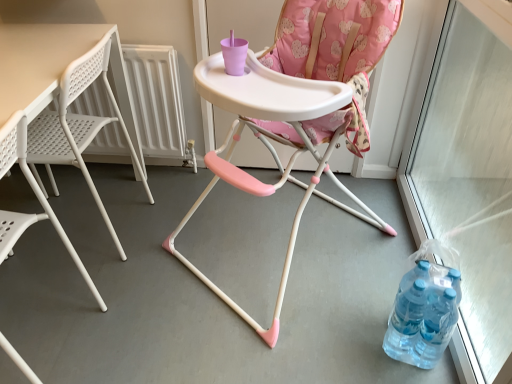
At what (x,y) coordinates should I click in order to perform the action: click on vacant area located to the right-hand side of white plastic table at left. Please return your answer as a coordinate pair (x, y). This screenshot has height=384, width=512. Looking at the image, I should click on (174, 231).